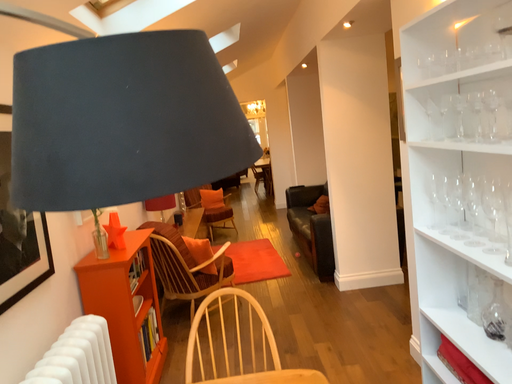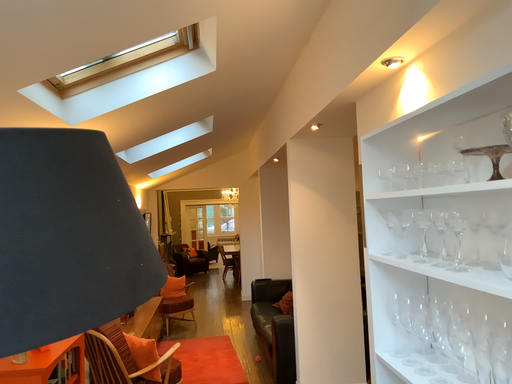
Question: How did the camera likely rotate when shooting the video?

Choices:
 (A) rotated upward
 (B) rotated downward

Answer: (A)